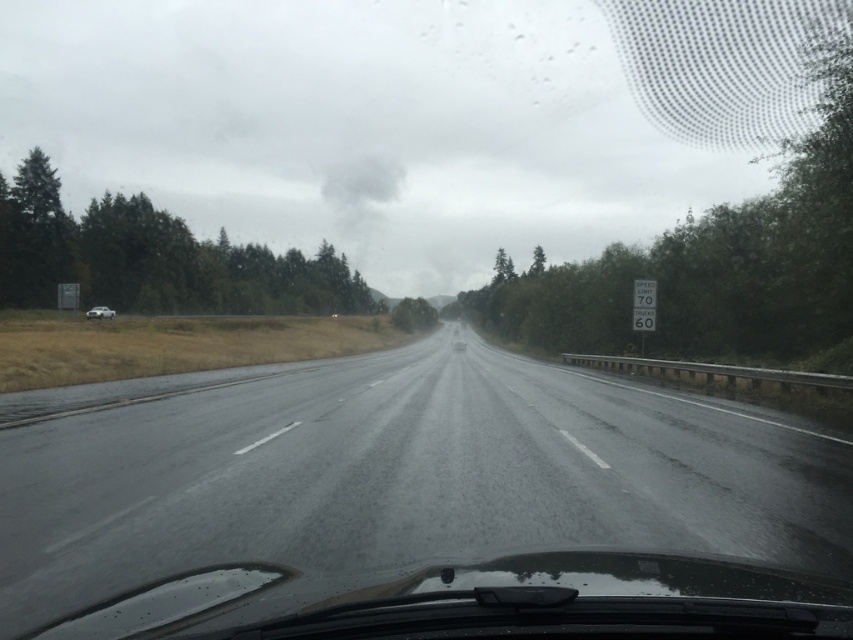
You are a GPS navigator and need to determine the exact 2D coordinates of the dark asphalt highway at center in the image. What are its coordinates?

The dark asphalt highway at center is located at the 2D coordinates of point (395, 472).

You are driving a car and want to safely pass the silver metallic sedan at left on the dark asphalt highway at center. Based on the road conditions, is there enough space to maneuver?

The dark asphalt highway at center might be wider than silver metallic sedan at left, so there could be sufficient space to safely pass the sedan if the road width allows for a lane change without encroaching into oncoming traffic. However, caution is advised due to the wet and slippery conditions.

You are driving a car and see the dark asphalt highway at center represented by point (395, 472). Is the point located in the upper half or lower half of the image?

The point (395, 472) is located in the lower half of the image because the y coordinate is less than 0.5.